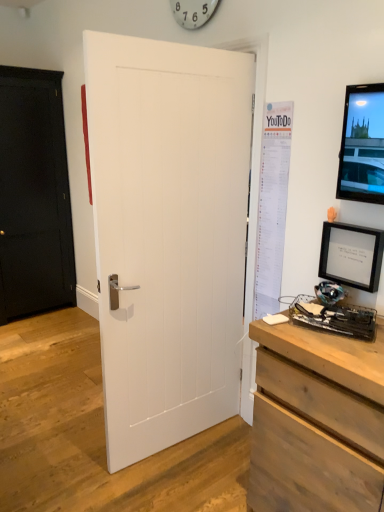
Where is `free space between metallic black desktop computer at lower right and white matte notepad at center`? The height and width of the screenshot is (512, 384). free space between metallic black desktop computer at lower right and white matte notepad at center is located at coordinates (297, 331).